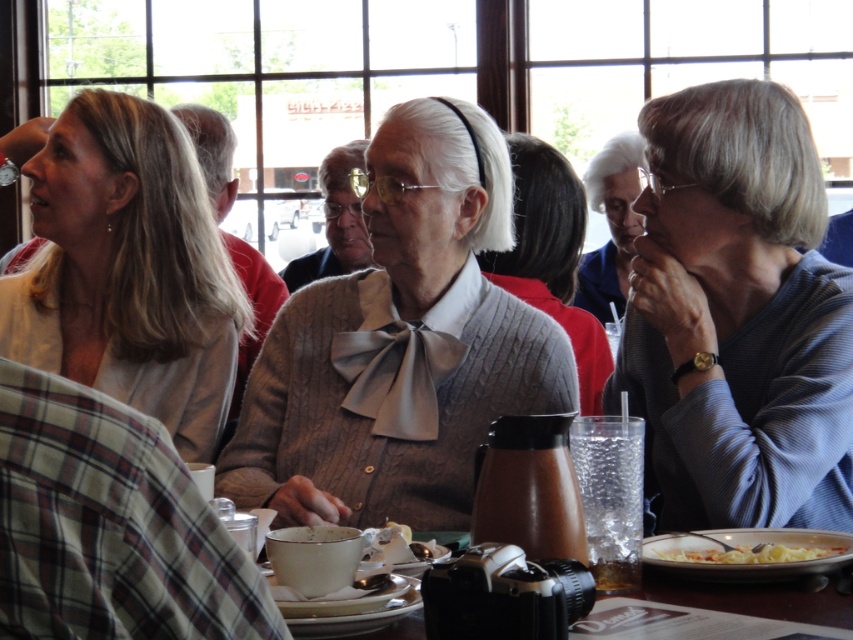
Does matte ceramic cup at lower center appear over white pasta at lower right?

Indeed, matte ceramic cup at lower center is positioned over white pasta at lower right.

Between matte ceramic cup at lower center and white pasta at lower right, which one appears on the right side from the viewer's perspective?

Positioned to the right is white pasta at lower right.

At what (x,y) coordinates should I click in order to perform the action: click on matte ceramic cup at lower center. Please return your answer as a coordinate pair (x, y). The height and width of the screenshot is (640, 853). Looking at the image, I should click on (332, 566).

Does matte black camera at center have a larger size compared to white crumbly cake at center?

Yes.

The image size is (853, 640). Identify the location of matte black camera at center. (740, 608).

The width and height of the screenshot is (853, 640). What are the coordinates of `matte black camera at center` in the screenshot? It's located at (740, 608).

Does matte ceramic cup at lower center lie behind blue fabric shirt at center?

No, matte ceramic cup at lower center is in front of blue fabric shirt at center.

What are the coordinates of `matte ceramic cup at lower center` in the screenshot? It's located at (332, 566).